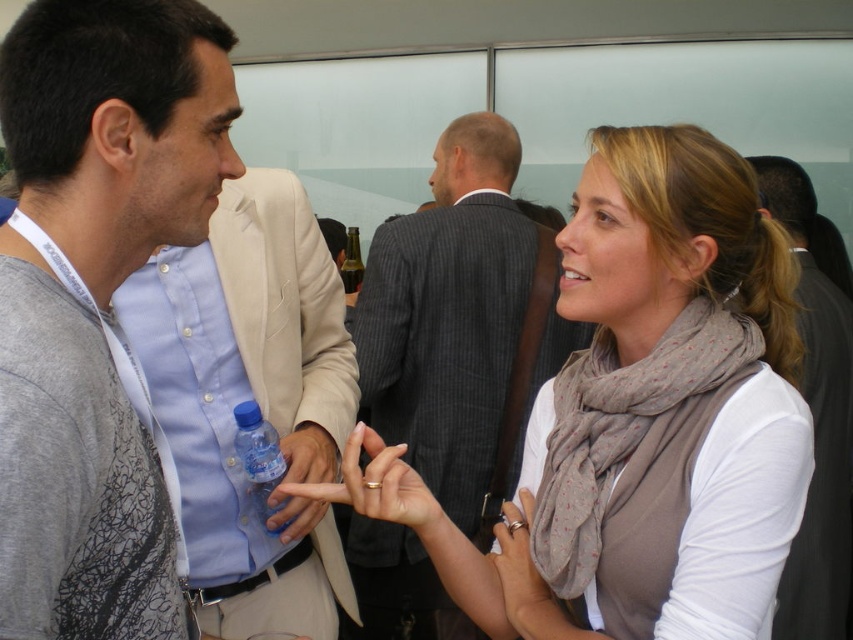
Question: Is light blue button-down shirt at center wider than clear glass bottle at center?

Choices:
 (A) yes
 (B) no

Answer: (A)

Question: Is gray pinstripe suit at center wider than dark gray suit at center?

Choices:
 (A) no
 (B) yes

Answer: (B)

Question: Which point is closer to the camera taking this photo?

Choices:
 (A) (207, 241)
 (B) (808, 596)
 (C) (285, 468)
 (D) (173, 200)

Answer: (D)

Question: Which is nearer to the gray fabric shirt at left?

Choices:
 (A) light gray scarf at center
 (B) dark gray suit at center

Answer: (A)

Question: Among these points, which one is nearest to the camera?

Choices:
 (A) (697, 470)
 (B) (312, 394)
 (C) (808, 529)
 (D) (485, 164)

Answer: (A)

Question: Is the position of light blue button-down shirt at center less distant than that of dark gray suit at center?

Choices:
 (A) yes
 (B) no

Answer: (A)